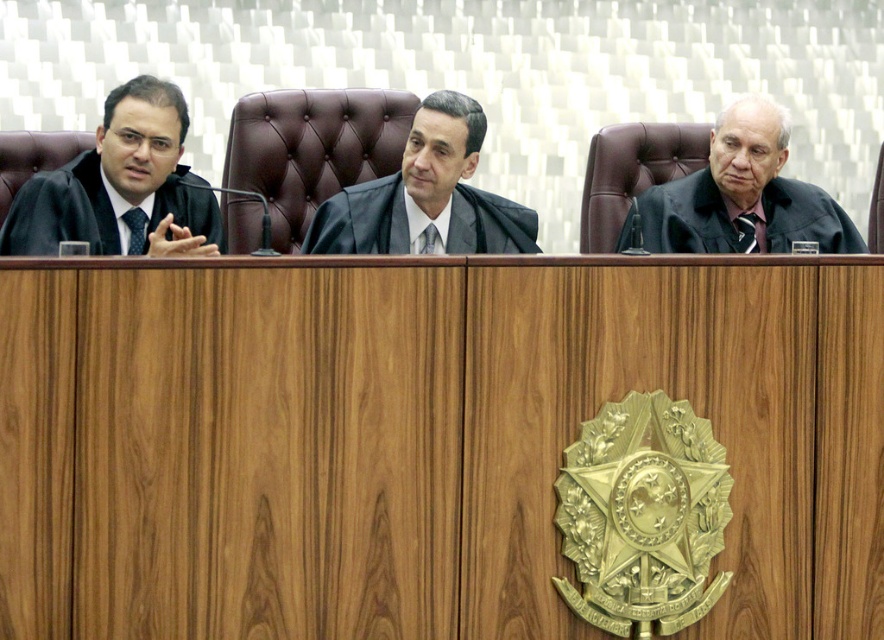
Question: Which object is closer to the camera taking this photo?

Choices:
 (A) matte black robe at left
 (B) black matte judge at center
 (C) black matte judge at right

Answer: (A)

Question: Does matte black robe at left lie behind black matte judge at right?

Choices:
 (A) no
 (B) yes

Answer: (A)

Question: Is matte black robe at left below black matte judge at right?

Choices:
 (A) yes
 (B) no

Answer: (A)

Question: Which object is the farthest from the matte black robe at left?

Choices:
 (A) black matte judge at right
 (B) black matte judge at center

Answer: (A)

Question: Does matte black robe at left appear under black matte judge at right?

Choices:
 (A) yes
 (B) no

Answer: (A)

Question: Which is farther from the black matte judge at right?

Choices:
 (A) matte black robe at left
 (B) black matte judge at center

Answer: (A)